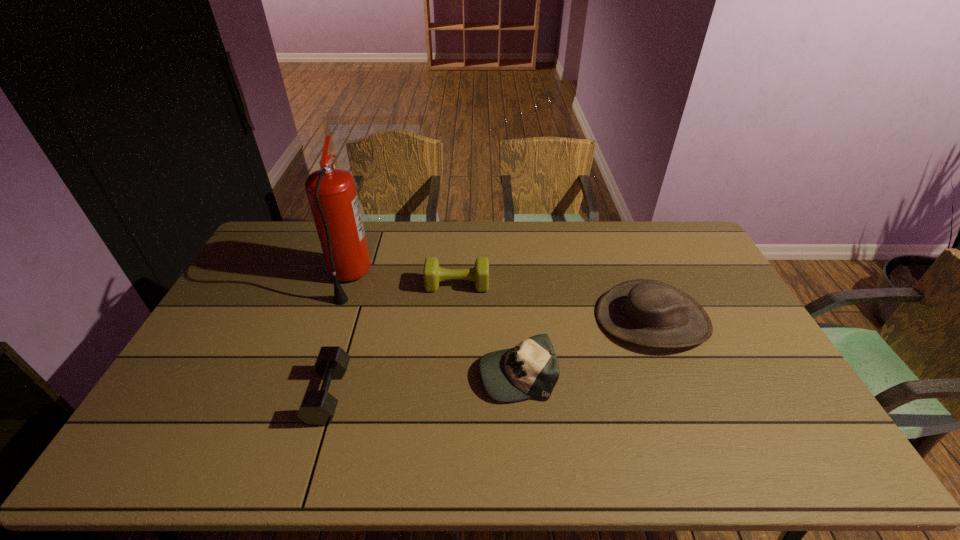
Identify which object is the second nearest to the left dumbbell. Please provide its 2D coordinates. Your answer should be formatted as a tuple, i.e. [(x, y)], where the tuple contains the x and y coordinates of a point satisfying the conditions above.

[(433, 274)]

I want to click on vacant space that satisfies the following two spatial constraints: 1. on the instruction side of the fire extinguisher; 2. on the right side of the right dumbbell, so click(347, 285).

Identify the location of vacant region that satisfies the following two spatial constraints: 1. on the instruction side of the fire extinguisher; 2. on the right side of the rightmost object. Image resolution: width=960 pixels, height=540 pixels. (335, 319).

You are a GUI agent. You are given a task and a screenshot of the screen. Output one action in this format:
    pyautogui.click(x=<x>, y=<y>)
    Task: Click on the vacant space that satisfies the following two spatial constraints: 1. on the instruction side of the tallest object; 2. on the right side of the farther dumbbell
    The image size is (960, 540).
    Given the screenshot: What is the action you would take?
    pyautogui.click(x=347, y=285)

Where is `free point that satisfies the following two spatial constraints: 1. on the instruction side of the rightmost object; 2. on the left side of the tallest object`? The height and width of the screenshot is (540, 960). free point that satisfies the following two spatial constraints: 1. on the instruction side of the rightmost object; 2. on the left side of the tallest object is located at coordinates (335, 319).